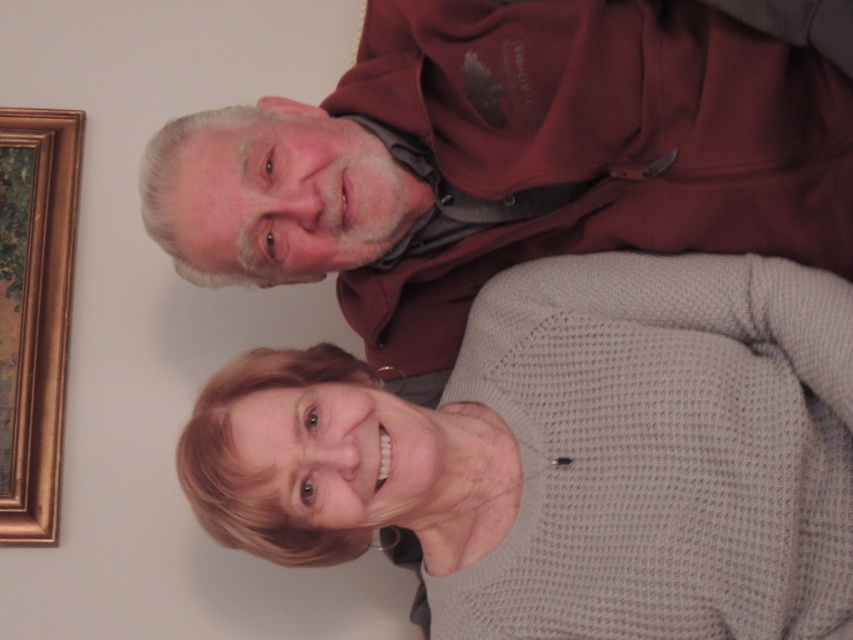
Consider the image. You are a tailor who needs to determine which clothing item requires a wider fabric width for production between the gray knitted sweater at center and the maroon hoodie at upper center. Based on the image, which one should you prioritize for wider fabric?

The maroon hoodie at upper center requires a wider fabric width since its width is greater than the gray knitted sweater at center.

You are a photographer standing at the camera position. You need to place a small decorative item exactly 3 feet away from the camera. Is the point at coordinates point (730, 216) suitable for placing the item?

The distance between point (730, 216) and the camera is 3.42 feet, which is slightly more than 3 feet. Therefore, placing the item at point (730, 216) would be 0.42 feet too far from the desired 3 feet distance.